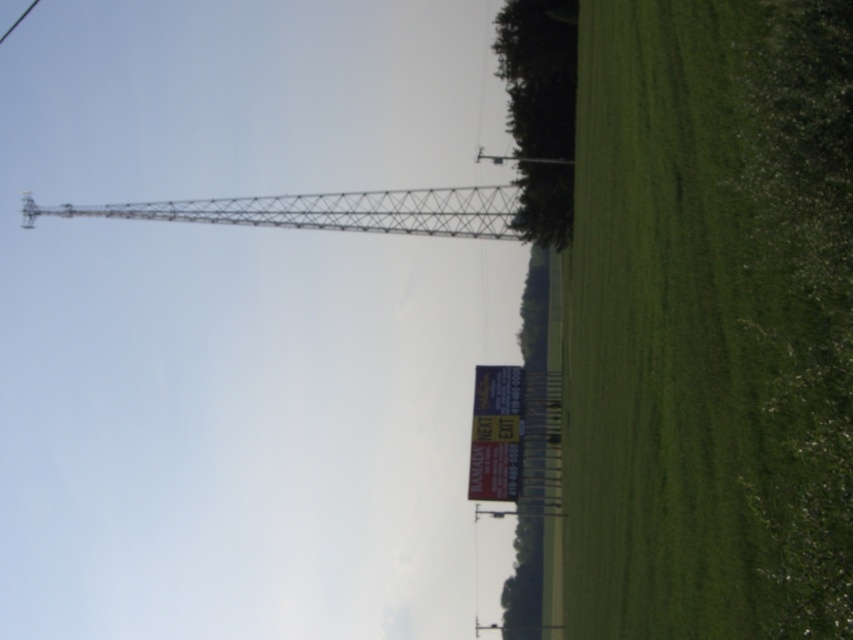
Between green grass at lower right and metallic lattice tower at upper center, which one appears on the left side from the viewer's perspective?

Positioned to the left is metallic lattice tower at upper center.

Does point (666, 227) come farther from viewer compared to point (335, 227)?

That is False.

Who is more distant from viewer, (778, 554) or (415, 227)?

The point (415, 227) is more distant.

The height and width of the screenshot is (640, 853). What are the coordinates of `green grass at lower right` in the screenshot? It's located at (711, 321).

Does green grass hedge at right appear over metallic sign at center?

Yes, green grass hedge at right is above metallic sign at center.

This screenshot has height=640, width=853. Describe the element at coordinates (805, 298) in the screenshot. I see `green grass hedge at right` at that location.

Does point (779, 388) come in front of point (479, 493)?

Yes.

I want to click on green grass hedge at right, so [805, 298].

Between metallic lattice tower at upper center and metallic sign at center, which one is positioned higher?

metallic lattice tower at upper center is above.

Locate an element on the screen. The width and height of the screenshot is (853, 640). metallic lattice tower at upper center is located at coordinates (329, 211).

At what (x,y) coordinates should I click in order to perform the action: click on metallic lattice tower at upper center. Please return your answer as a coordinate pair (x, y). Looking at the image, I should click on (329, 211).